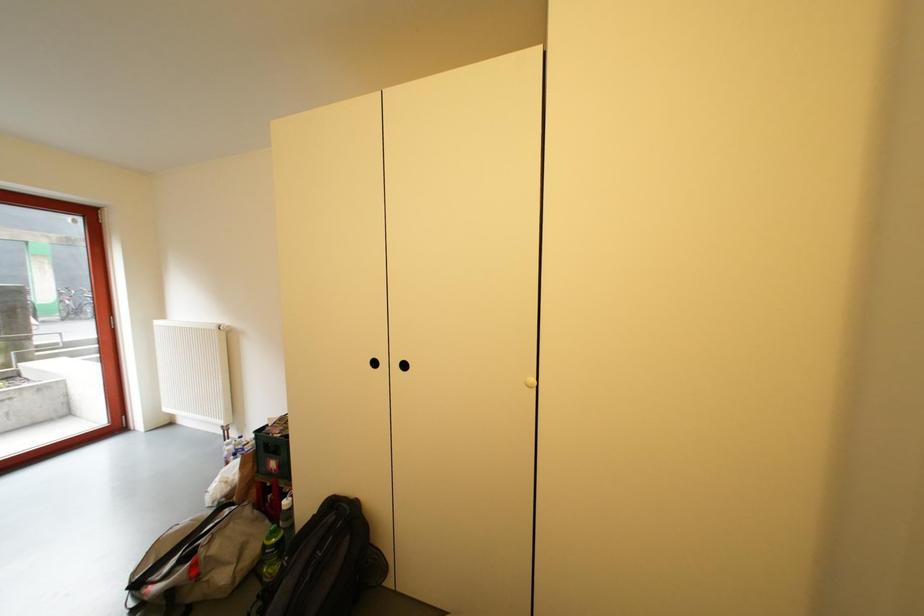
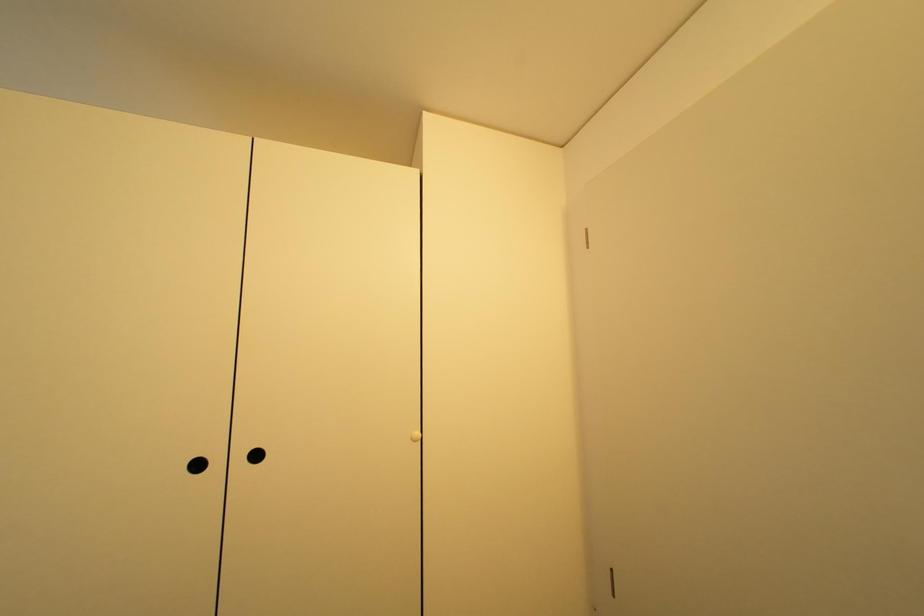
Question: How did the camera likely rotate?

Choices:
 (A) Left
 (B) Right
 (C) Up
 (D) Down

Answer: (B)